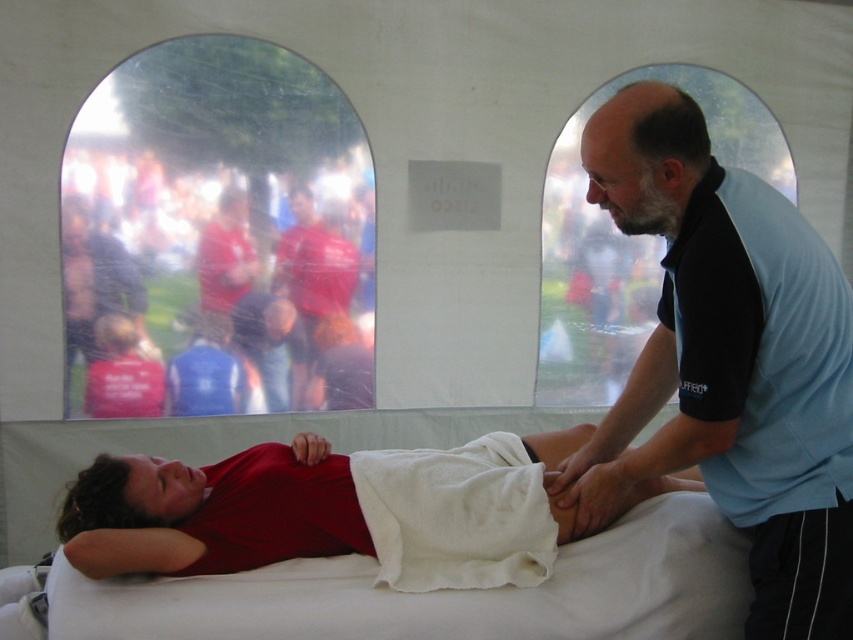
Question: Which point appears farthest from the camera in this image?

Choices:
 (A) (405, 528)
 (B) (715, 476)
 (C) (341, 243)

Answer: (C)

Question: Which of the following is the farthest from the observer?

Choices:
 (A) white soft cloth at center
 (B) red fabric shirt at center
 (C) red smooth shirt at center

Answer: (B)

Question: Among these objects, which one is nearest to the camera?

Choices:
 (A) white soft cloth at center
 (B) red smooth shirt at center
 (C) blue shirt at upper right
 (D) red fabric shirt at center

Answer: (C)

Question: Is red smooth shirt at center smaller than white soft cloth at center?

Choices:
 (A) no
 (B) yes

Answer: (A)

Question: In this image, where is blue shirt at upper right located relative to red smooth shirt at center?

Choices:
 (A) left
 (B) right

Answer: (B)

Question: In this image, where is blue shirt at upper right located relative to red fabric shirt at center?

Choices:
 (A) right
 (B) left

Answer: (A)